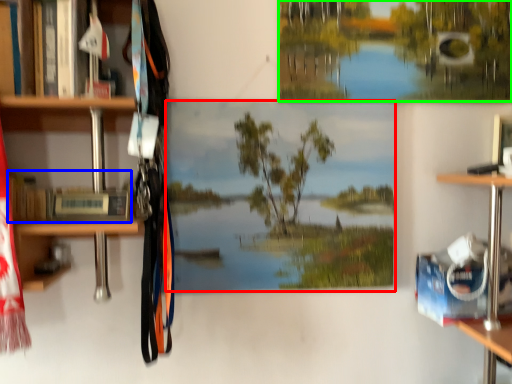
Question: Which object is positioned closest to mural (highlighted by a red box)? Select from book (highlighted by a blue box) and tree (highlighted by a green box).

Choices:
 (A) book
 (B) tree

Answer: (B)